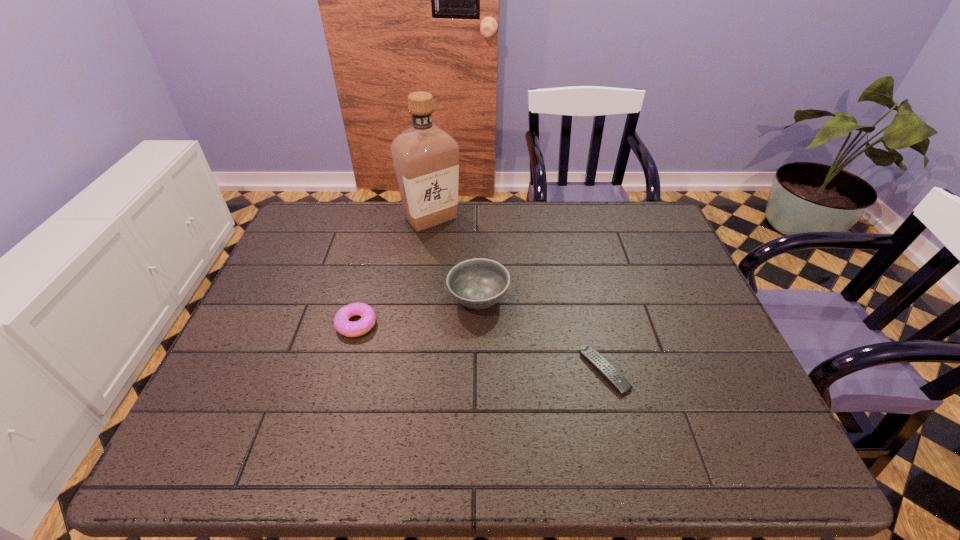
I want to click on free space that satisfies the following two spatial constraints: 1. on the front-facing side of the shortest object; 2. on the right side of the liquor, so (410, 371).

Identify the location of free space that satisfies the following two spatial constraints: 1. on the front-facing side of the bowl; 2. on the right side of the tallest object. (420, 299).

Locate an element on the screen. The height and width of the screenshot is (540, 960). free space that satisfies the following two spatial constraints: 1. on the front-facing side of the farthest object; 2. on the right side of the bowl is located at coordinates (420, 299).

At what (x,y) coordinates should I click in order to perform the action: click on vacant area that satisfies the following two spatial constraints: 1. on the front-facing side of the bowl; 2. on the right side of the farthest object. Please return your answer as a coordinate pair (x, y). Looking at the image, I should click on (420, 299).